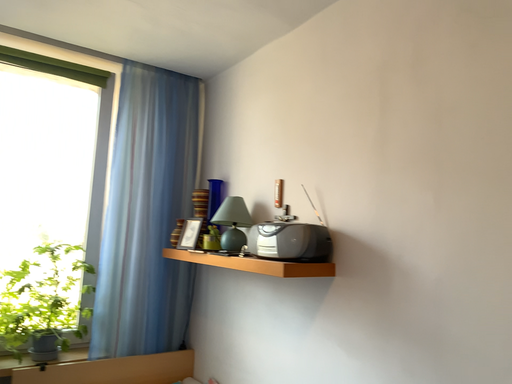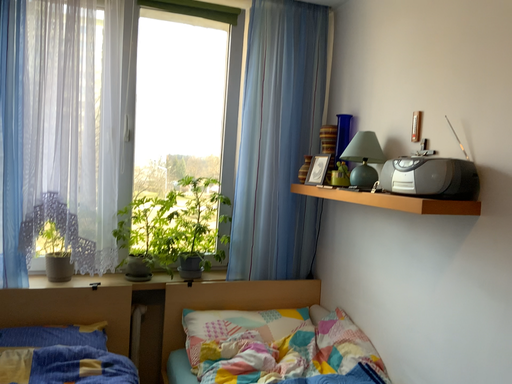
Question: How did the camera likely rotate when shooting the video?

Choices:
 (A) rotated left
 (B) rotated right

Answer: (A)